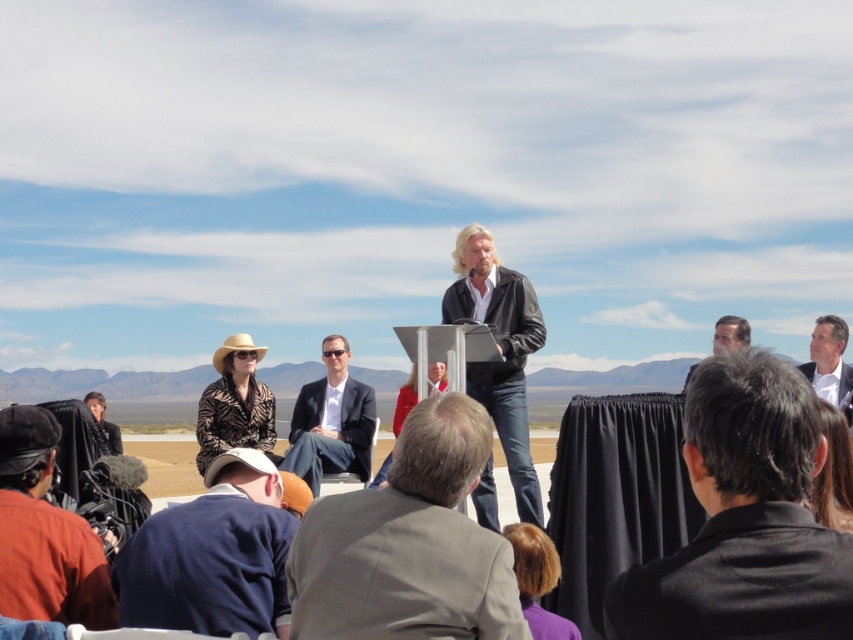
Question: Estimate the real-world distances between objects in this image. Which object is farther from the matte red coat at center?

Choices:
 (A) gray suit at center
 (B) white glossy suit at lower right
 (C) black leather jacket at lower right

Answer: (C)

Question: Does leopard print hat at lower left come behind light brown leather jacket at lower right?

Choices:
 (A) yes
 (B) no

Answer: (B)

Question: Does black leather jacket at center appear on the left side of dark blue suit at center?

Choices:
 (A) yes
 (B) no

Answer: (B)

Question: Observing the image, what is the correct spatial positioning of blonde hair at lower center in reference to leather jacket at lower left?

Choices:
 (A) below
 (B) above

Answer: (B)

Question: Which object appears closest to the camera in this image?

Choices:
 (A) light brown leather jacket at lower right
 (B) dark blue suit at center
 (C) black leather jacket at center
 (D) leather jacket at lower left

Answer: (C)

Question: Which object is farther from the camera taking this photo?

Choices:
 (A) blonde hair at lower center
 (B) leopard print hat at lower left
 (C) blonde hair at center

Answer: (B)